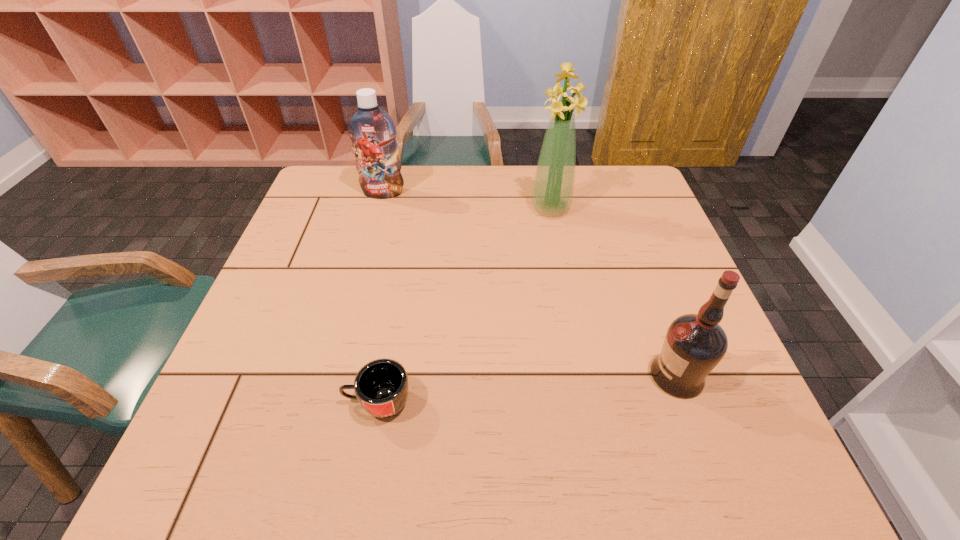
The width and height of the screenshot is (960, 540). Identify the location of free space between the shampoo and the mug. (380, 297).

The image size is (960, 540). Find the location of `object that is the nearest to the rightmost object`. object that is the nearest to the rightmost object is located at coordinates pos(553,186).

You are a GUI agent. You are given a task and a screenshot of the screen. Output one action in this format:
    pyautogui.click(x=<x>, y=<y>)
    Task: Click on the object that is the second closest to the shortest object
    The image size is (960, 540).
    Given the screenshot: What is the action you would take?
    pyautogui.click(x=553, y=186)

Image resolution: width=960 pixels, height=540 pixels. Find the location of `free location that satisfies the following two spatial constraints: 1. on the front-facing side of the bouquet; 2. on the side of the mug with the handle`. free location that satisfies the following two spatial constraints: 1. on the front-facing side of the bouquet; 2. on the side of the mug with the handle is located at coordinates (587, 402).